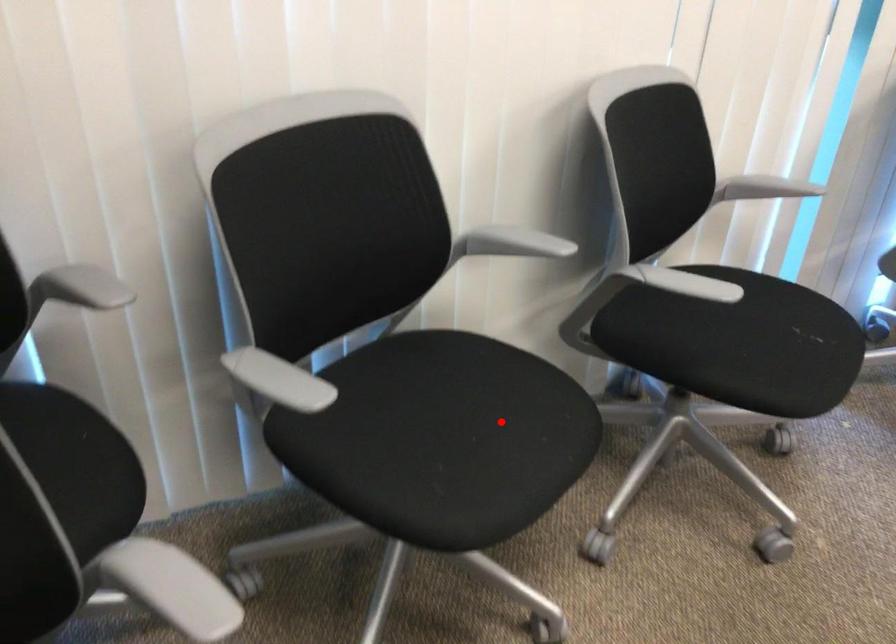
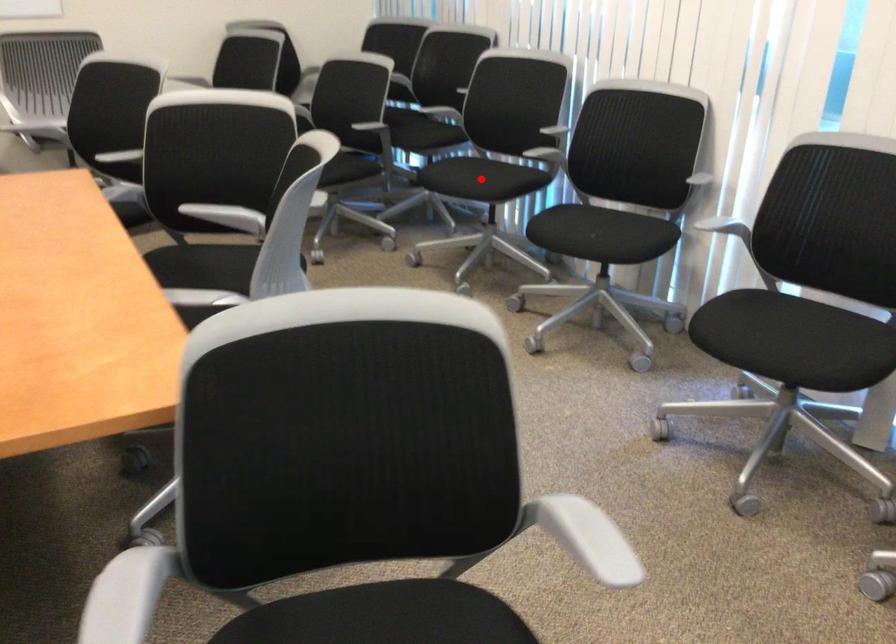
I am providing you with two images of the same scene from different viewpoints. A red point is marked on the first image and another point is marked on the second image. Does the point marked in image1 correspond to the same location as the one in image2?

Yes